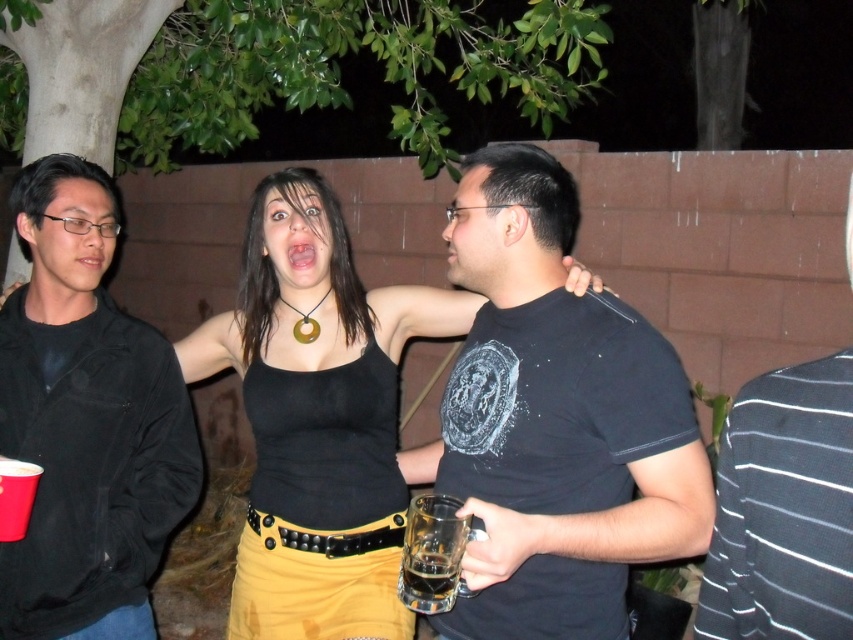
Question: Among these objects, which one is farthest from the camera?

Choices:
 (A) striped cotton shirt at right
 (B) translucent glass at center

Answer: (B)

Question: In this image, where is black matte t-shirt at center located relative to transparent glass at center?

Choices:
 (A) right
 (B) left

Answer: (A)

Question: Does black matte t-shirt at center have a lesser width compared to matte black jacket at left?

Choices:
 (A) no
 (B) yes

Answer: (A)

Question: Is black matte t-shirt at center bigger than black tank top at center?

Choices:
 (A) no
 (B) yes

Answer: (A)

Question: Which object is positioned closest to the transparent glass at center?

Choices:
 (A) matte black jacket at left
 (B) black matte t-shirt at center
 (C) translucent glass at center

Answer: (C)

Question: Which of these objects is positioned closest to the matte black jacket at left?

Choices:
 (A) black matte t-shirt at center
 (B) translucent glass at center
 (C) black tank top at center

Answer: (C)